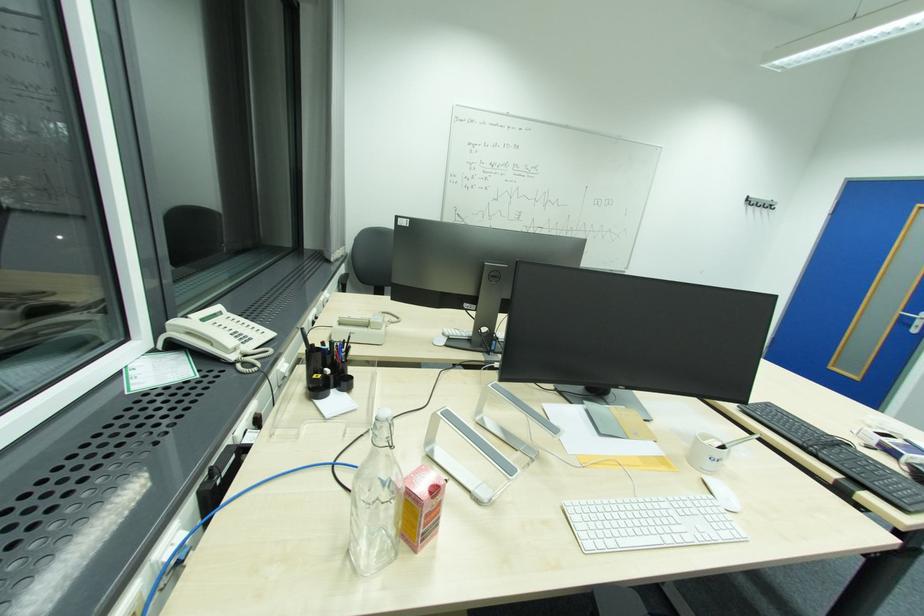
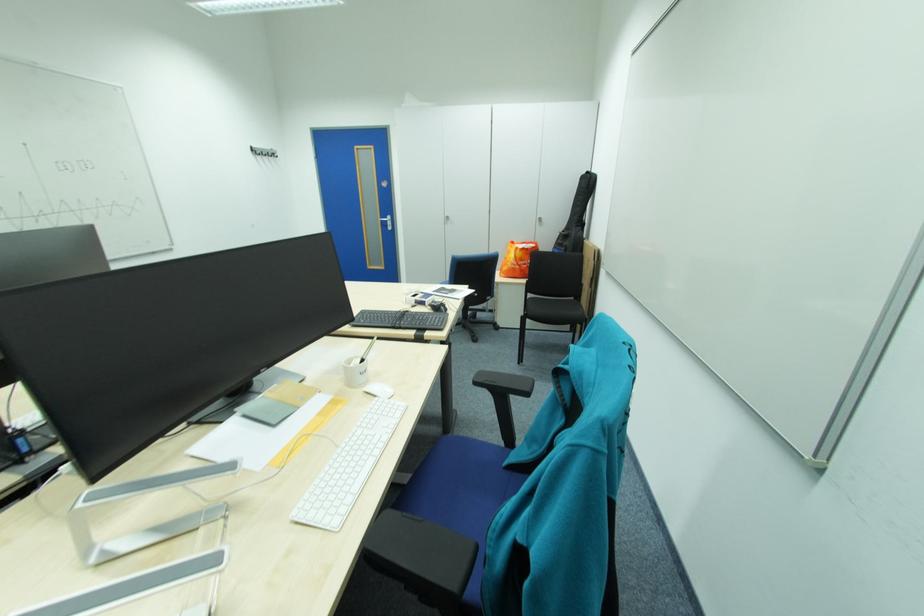
Locate, in the second image, the point that corresponds to point 755,204 in the first image.

(262, 153)